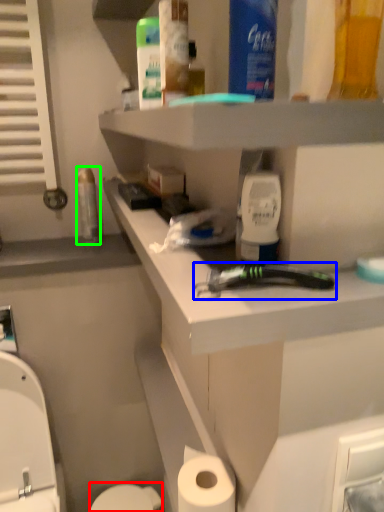
Question: Based on their relative distances, which object is farther from toilet bowl (highlighted by a red box)? Choose from tool (highlighted by a blue box) and mouthwash (highlighted by a green box).

Choices:
 (A) tool
 (B) mouthwash

Answer: (A)